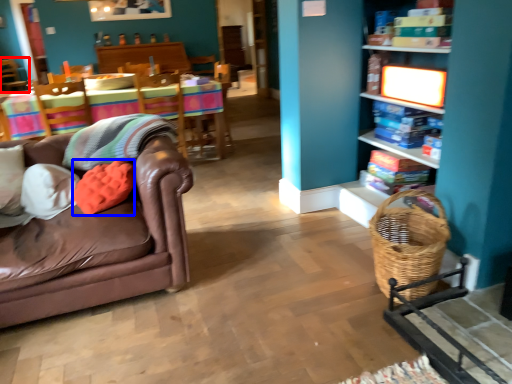
Question: Which object is further to the camera taking this photo, chair (highlighted by a red box) or pillow (highlighted by a blue box)?

Choices:
 (A) chair
 (B) pillow

Answer: (A)